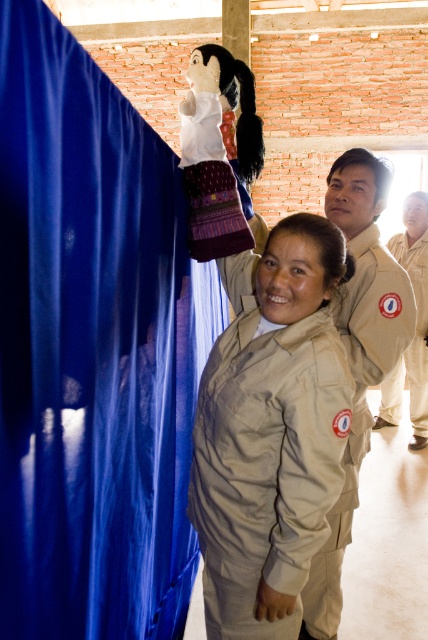
Question: Which point is farther to the camera?

Choices:
 (A) (410, 352)
 (B) (178, 435)

Answer: (A)

Question: Does blue fabric curtain at left have a lesser width compared to beige uniform at center?

Choices:
 (A) yes
 (B) no

Answer: (A)

Question: Does blue fabric curtain at left appear over beige uniform at center?

Choices:
 (A) no
 (B) yes

Answer: (A)

Question: Can you confirm if blue fabric curtain at left is wider than beige uniform at center?

Choices:
 (A) no
 (B) yes

Answer: (A)

Question: Which point is closer to the camera?

Choices:
 (A) (42, 38)
 (B) (377, 426)

Answer: (A)